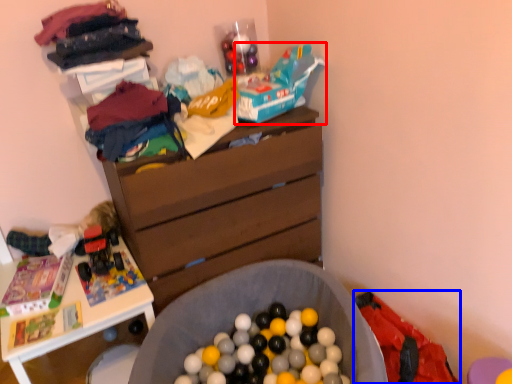
Question: Among these objects, which one is nearest to the camera, toy car (highlighted by a red box) or underclothes (highlighted by a blue box)?

Choices:
 (A) toy car
 (B) underclothes

Answer: (B)